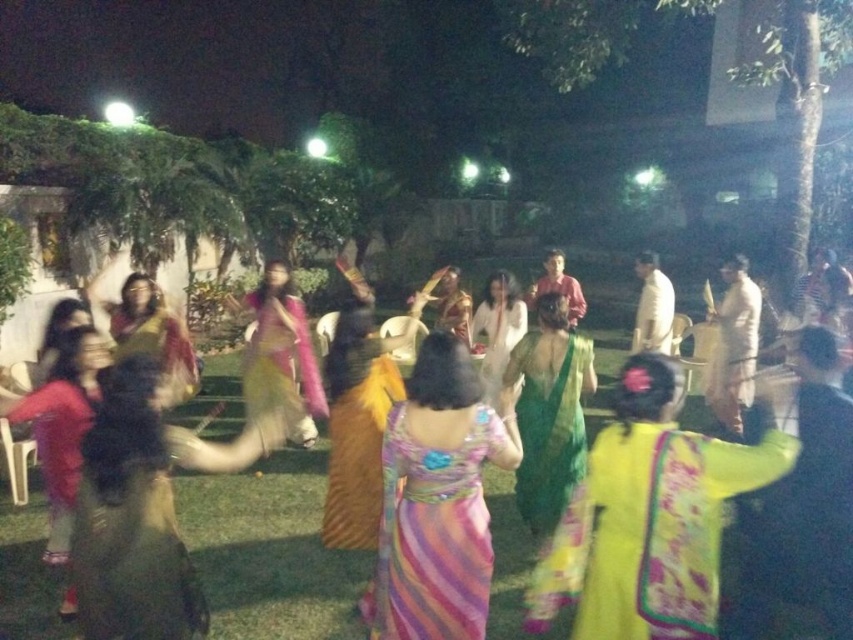
You are attending a night gathering and want to find the multicolored silk saree at center. The organizers have placed a marker at point (271,550). Is the marker placed correctly?

The marker at point (271,550) is correctly placed because the multicolored silk saree at center is located exactly at that coordinate.

You are a photographer at the event and want to capture both the multicolored satin dress at center and the matte pink shirt at center in a single frame. Which of the two items should you focus on first to ensure they both fit in the photo?

Since the multicolored satin dress at center is smaller than the matte pink shirt at center, you should focus on the matte pink shirt at center first to ensure both fit in the photo.

You are standing at the center of the gathering and want to move towards the two points marked in the image. Which point, point (x=759, y=294) or point (x=552, y=285), is closer to you?

Point (x=759, y=294) is closer to the viewer than point (x=552, y=285), so you should move towards point (x=759, y=294) first.